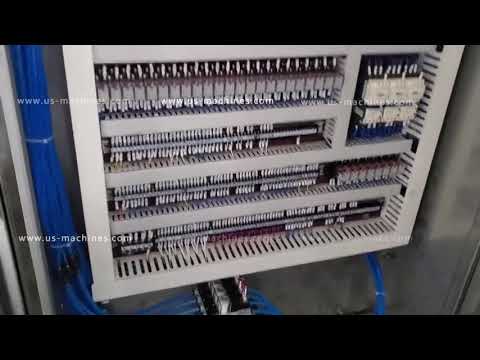
Where is `right side of stainless steel cabinet`? right side of stainless steel cabinet is located at coordinates (460, 201).